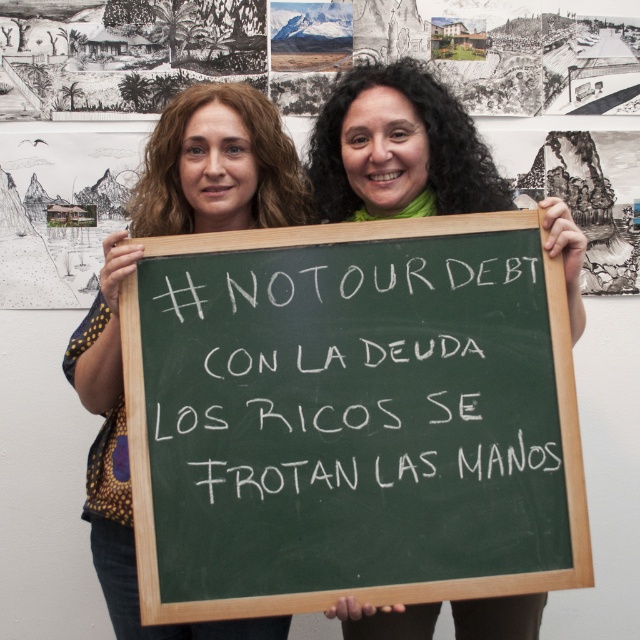
Does point (422, 408) come closer to viewer compared to point (436, 138)?

Yes, point (422, 408) is in front of point (436, 138).

Who is lower down, green chalkboard at center or green fabric scarf at center?

green chalkboard at center

Between point (216, 244) and point (483, 157), which one is positioned in front?

Point (216, 244)

Locate an element on the screen. The image size is (640, 640). green chalkboard at center is located at coordinates (352, 417).

Does point (225, 90) lie in front of point (422, 180)?

Yes, point (225, 90) is closer to viewer.

Image resolution: width=640 pixels, height=640 pixels. What do you see at coordinates (218, 164) in the screenshot?
I see `matte black board at center` at bounding box center [218, 164].

Consider the image. Who is more distant from viewer, (170,628) or (456,609)?

The point (456,609) is more distant.

Where is `matte black board at center`? matte black board at center is located at coordinates (218, 164).

Which is above, green chalkboard at center or matte black board at center?

matte black board at center is above.

Based on the photo, between green chalkboard at center and matte black board at center, which one has less height?

With less height is green chalkboard at center.

Where is `green chalkboard at center`? The height and width of the screenshot is (640, 640). green chalkboard at center is located at coordinates (352, 417).